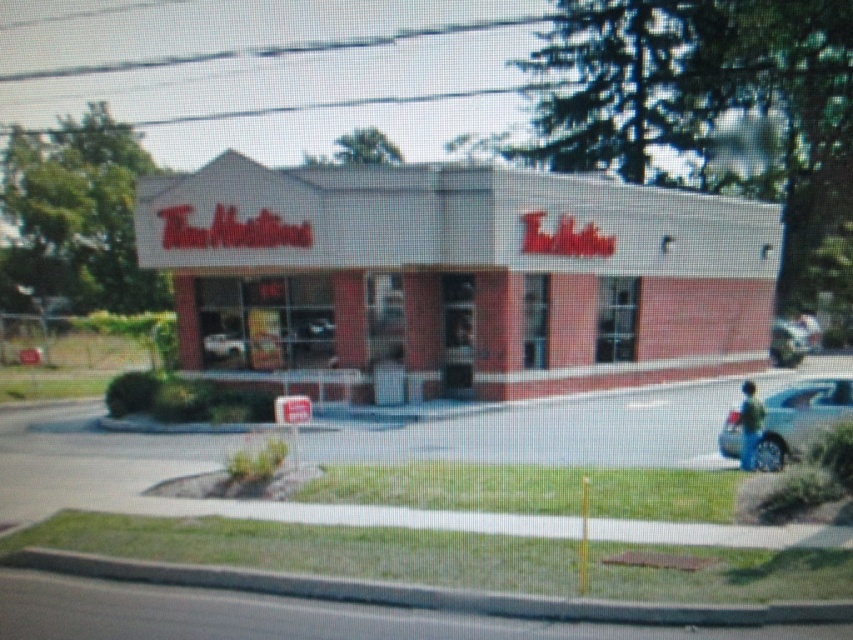
Which is behind, point (785, 392) or point (798, 360)?

Positioned behind is point (798, 360).

Can you confirm if metallic blue sedan at lower right is positioned below metallic silver car at right?

Correct, metallic blue sedan at lower right is located below metallic silver car at right.

Find the location of a particular element. This screenshot has width=853, height=640. metallic blue sedan at lower right is located at coordinates (801, 419).

Does white brick tim hortons at center appear on the right side of metallic blue sedan at lower right?

Incorrect, white brick tim hortons at center is not on the right side of metallic blue sedan at lower right.

Which is in front, point (227, 228) or point (729, 417)?

Point (729, 417) is more forward.

This screenshot has width=853, height=640. I want to click on white brick tim hortons at center, so click(456, 278).

Which is more to the left, green fabric jacket at lower right or metallic silver car at right?

From the viewer's perspective, green fabric jacket at lower right appears more on the left side.

The image size is (853, 640). Describe the element at coordinates (750, 424) in the screenshot. I see `green fabric jacket at lower right` at that location.

Locate an element on the screen. Image resolution: width=853 pixels, height=640 pixels. green fabric jacket at lower right is located at coordinates (750, 424).